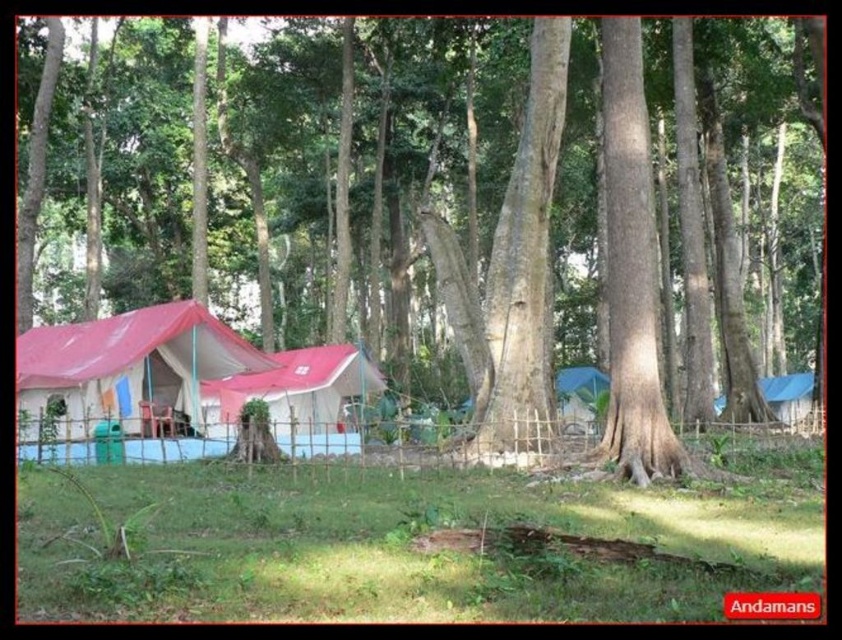
Question: Which point is closer to the camera?

Choices:
 (A) matte red tent at lower left
 (B) smooth bark tree at center

Answer: (B)

Question: Can you confirm if smooth bark tree at center is wider than matte red tent at center?

Choices:
 (A) no
 (B) yes

Answer: (B)

Question: Among these objects, which one is farthest from the camera?

Choices:
 (A) matte red tent at lower left
 (B) smooth bark tree at center

Answer: (A)

Question: Is smooth bark tree at center to the left of matte red tent at center from the viewer's perspective?

Choices:
 (A) yes
 (B) no

Answer: (A)

Question: Which of these objects is positioned closest to the matte red tent at center?

Choices:
 (A) matte red tent at lower left
 (B) smooth bark tree at center

Answer: (A)

Question: Is matte red tent at lower left smaller than matte red tent at center?

Choices:
 (A) yes
 (B) no

Answer: (A)